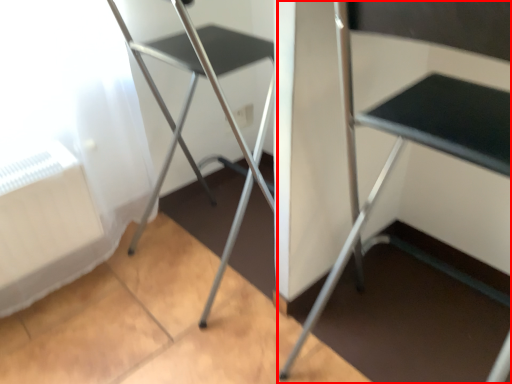
Question: Where is furniture (annotated by the red box) located in relation to chair in the image?

Choices:
 (A) left
 (B) right

Answer: (B)